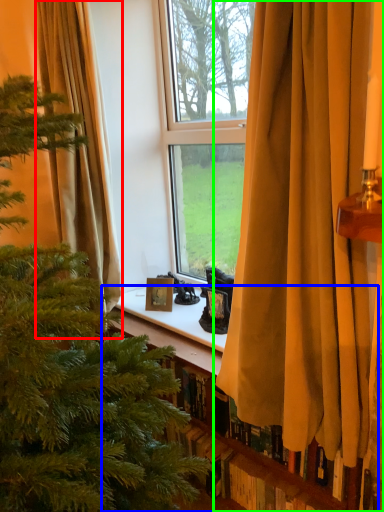
Question: Which object is the closest to the curtain (highlighted by a red box)? Choose among these: bookshelf (highlighted by a blue box) or curtain (highlighted by a green box).

Choices:
 (A) bookshelf
 (B) curtain

Answer: (B)